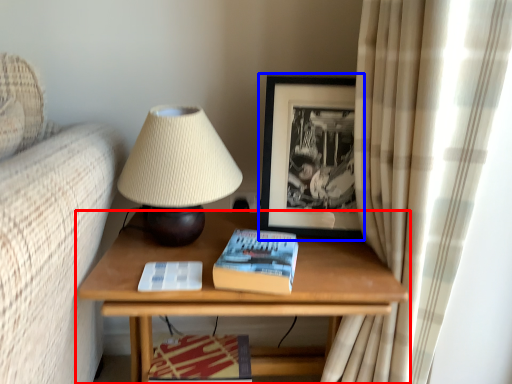
Question: Among these objects, which one is farthest to the camera, table (highlighted by a red box) or picture frame (highlighted by a blue box)?

Choices:
 (A) table
 (B) picture frame

Answer: (B)